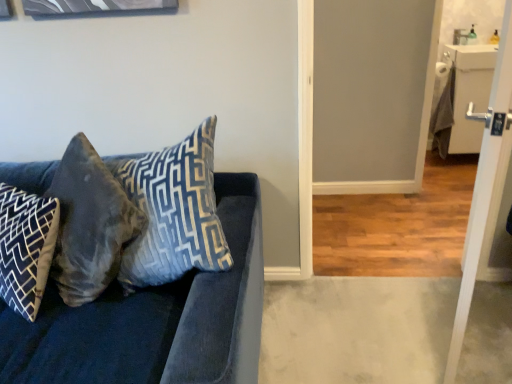
Find the location of a particular element. free point behind white glossy door at right is located at coordinates (403, 285).